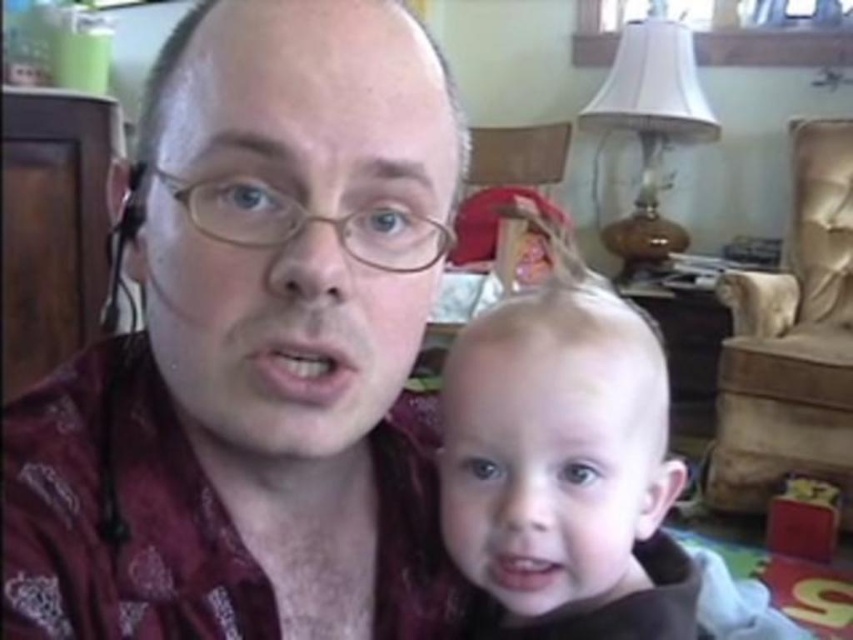
Who is positioned more to the left, maroon patterned shirt at center or blonde hair at center?

maroon patterned shirt at center

Does maroon patterned shirt at center have a lesser height compared to blonde hair at center?

No.

Is point (94, 452) closer to viewer compared to point (677, 488)?

Yes, point (94, 452) is closer to viewer.

I want to click on maroon patterned shirt at center, so click(x=254, y=349).